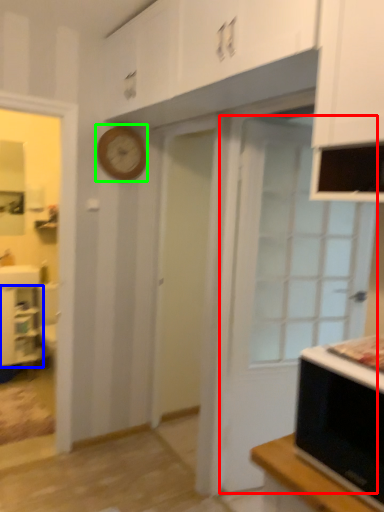
Question: Which object is the farthest from door (highlighted by a red box)? Choose among these: cabinetry (highlighted by a blue box) or clock (highlighted by a green box).

Choices:
 (A) cabinetry
 (B) clock

Answer: (A)